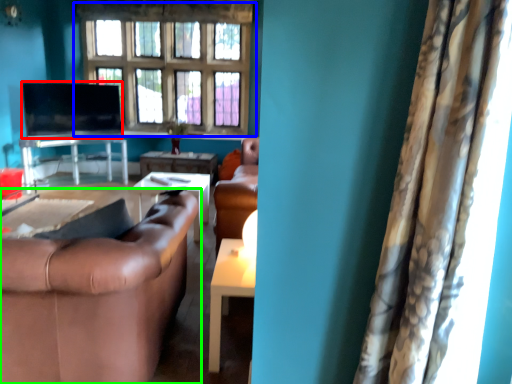
Question: Which object is positioned farthest from flat (highlighted by a red box)? Select from window (highlighted by a blue box) and studio couch (highlighted by a green box).

Choices:
 (A) window
 (B) studio couch

Answer: (B)